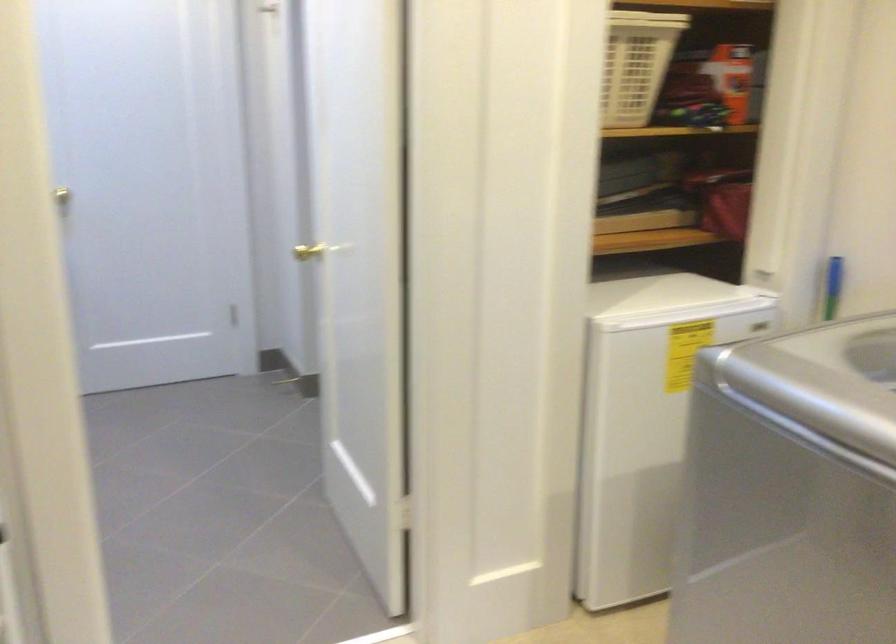
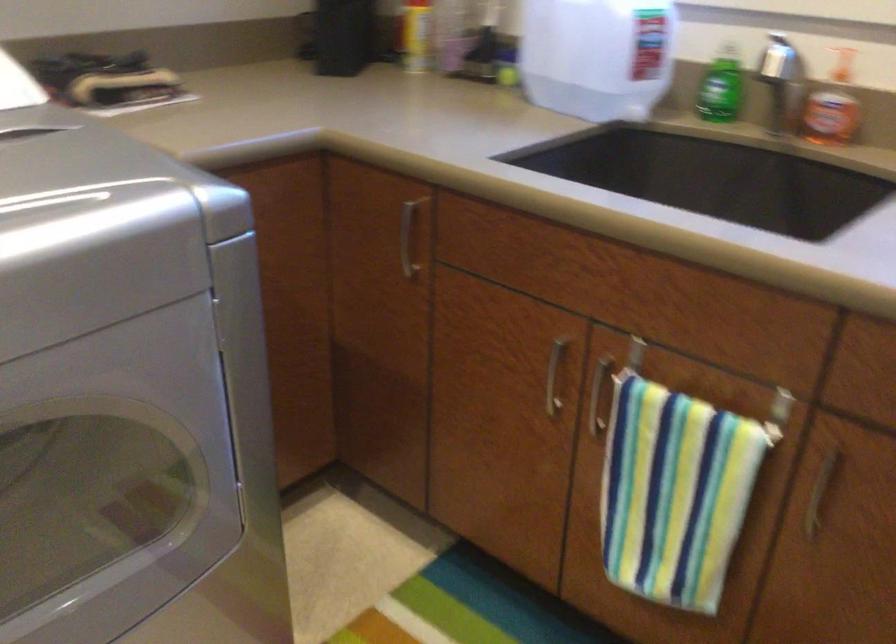
The images are taken continuously from a first-person perspective. In which direction is your viewpoint rotating?

The rotation direction of the camera is right-down.